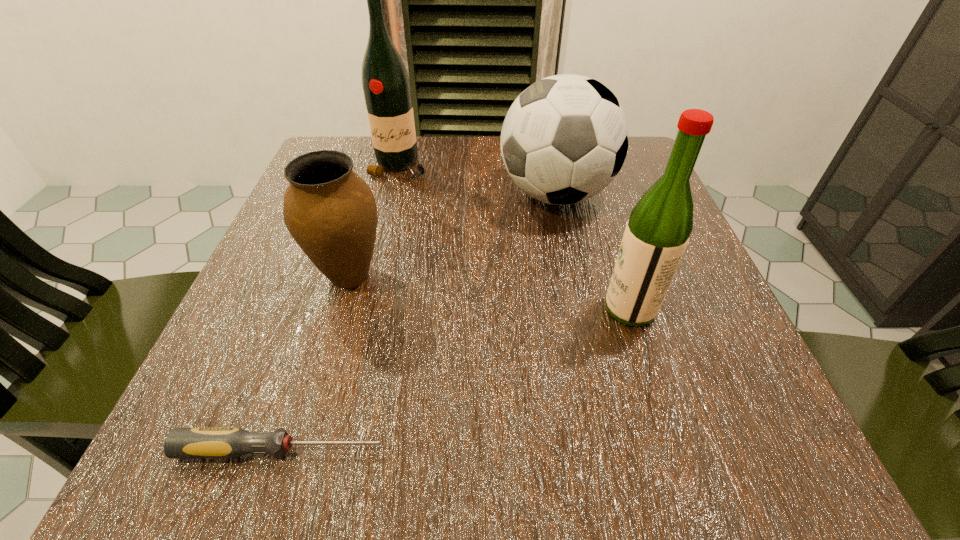
I want to click on screwdriver that is at the left edge, so click(229, 442).

Where is `liquor at the right edge`? Image resolution: width=960 pixels, height=540 pixels. liquor at the right edge is located at coordinates pos(657,233).

This screenshot has height=540, width=960. I want to click on soccer ball at the right edge, so click(x=564, y=139).

Identify the location of object that is at the far left corner. (386, 86).

I want to click on object that is at the near left corner, so click(x=229, y=442).

Where is `object that is at the far right corner`? This screenshot has width=960, height=540. object that is at the far right corner is located at coordinates (564, 139).

Find the location of a particular element. vacant space at the far edge of the desktop is located at coordinates (476, 140).

Where is `vacant area at the near edge of the desktop`? Image resolution: width=960 pixels, height=540 pixels. vacant area at the near edge of the desktop is located at coordinates (578, 421).

This screenshot has height=540, width=960. In order to click on blank area at the left edge in this screenshot , I will do `click(276, 233)`.

In the image, there is a desktop. In order to click on vacant region at the right edge in this screenshot , I will do `click(733, 353)`.